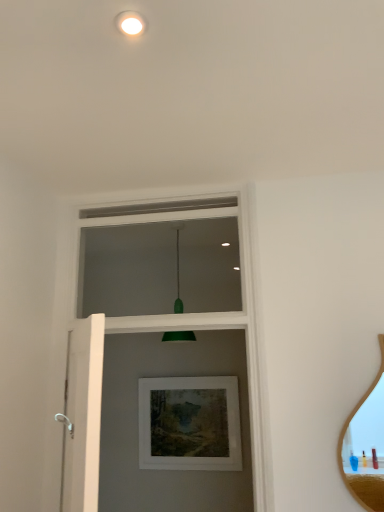
Question: Is matte white picture frame at center wider than wooden mirror at right?

Choices:
 (A) no
 (B) yes

Answer: (B)

Question: Considering the relative positions of matte white picture frame at center and wooden mirror at right in the image provided, is matte white picture frame at center to the left of wooden mirror at right from the viewer's perspective?

Choices:
 (A) no
 (B) yes

Answer: (B)

Question: Could wooden mirror at right be considered to be inside matte white picture frame at center?

Choices:
 (A) no
 (B) yes

Answer: (A)

Question: Can you confirm if matte white picture frame at center is bigger than wooden mirror at right?

Choices:
 (A) yes
 (B) no

Answer: (A)

Question: Is matte white picture frame at center oriented away from wooden mirror at right?

Choices:
 (A) no
 (B) yes

Answer: (A)

Question: Visually, is wooden mirror at right positioned to the left or to the right of matte white picture frame at center?

Choices:
 (A) right
 (B) left

Answer: (A)

Question: Does point (370, 411) appear closer or farther from the camera than point (198, 412)?

Choices:
 (A) farther
 (B) closer

Answer: (B)

Question: From the image's perspective, is wooden mirror at right positioned above or below matte white picture frame at center?

Choices:
 (A) below
 (B) above

Answer: (B)

Question: From a real-world perspective, relative to matte white picture frame at center, is wooden mirror at right vertically above or below?

Choices:
 (A) above
 (B) below

Answer: (A)

Question: Is point (82, 468) closer or farther from the camera than point (125, 22)?

Choices:
 (A) closer
 (B) farther

Answer: (B)

Question: From a real-world perspective, is white matte screen door at left physically located above or below green matte droplight at upper center?

Choices:
 (A) above
 (B) below

Answer: (B)

Question: In terms of height, does white matte screen door at left look taller or shorter compared to green matte droplight at upper center?

Choices:
 (A) short
 (B) tall

Answer: (B)

Question: Would you say white matte screen door at left is to the left or to the right of green matte droplight at upper center in the picture?

Choices:
 (A) right
 (B) left

Answer: (B)

Question: From the image's perspective, is white matte screen door at left positioned above or below matte white picture frame at center?

Choices:
 (A) below
 (B) above

Answer: (B)

Question: From a real-world perspective, relative to matte white picture frame at center, is white matte screen door at left vertically above or below?

Choices:
 (A) above
 (B) below

Answer: (A)